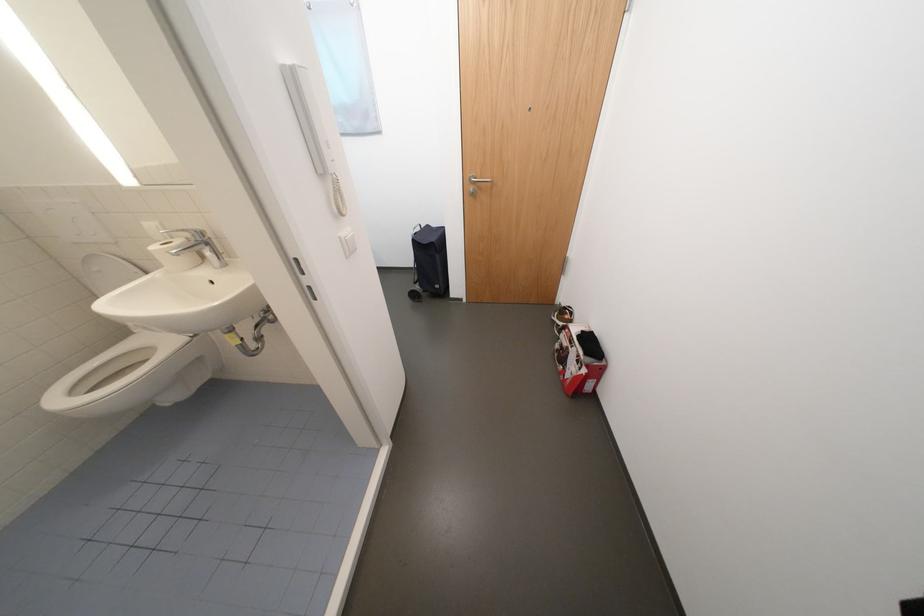
Where would you lift the intercom handset? Please return your answer as a coordinate pair (x, y).

(309, 116)